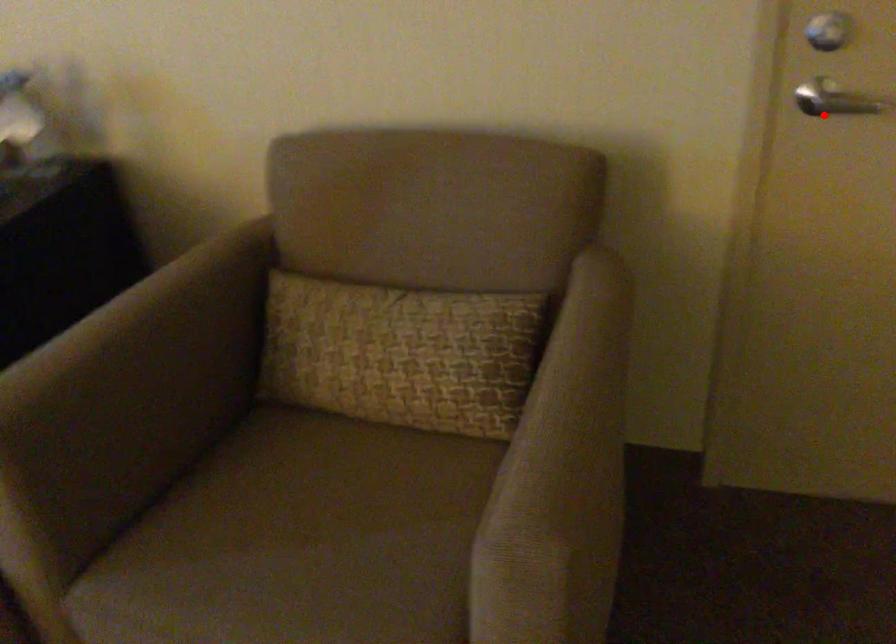
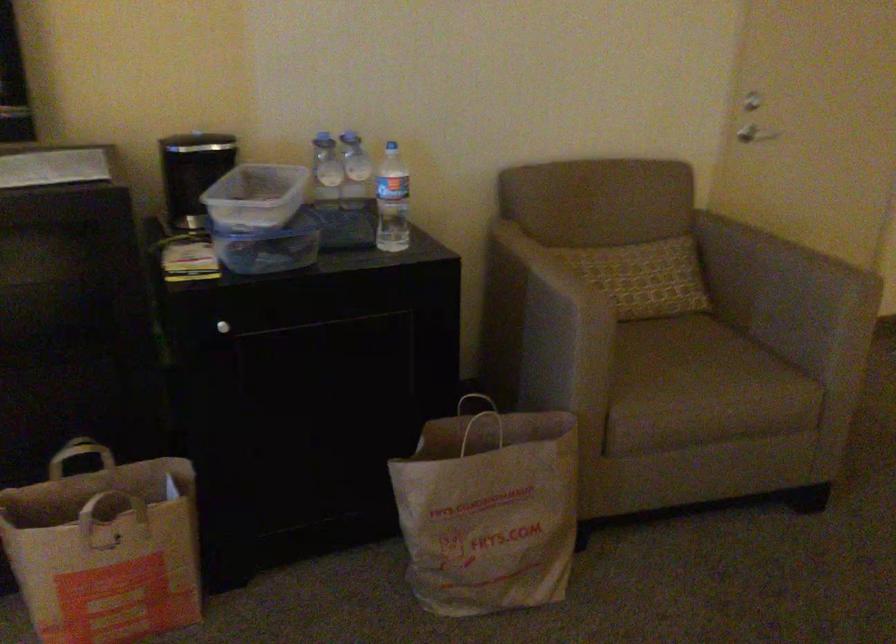
Locate, in the second image, the point that corresponds to the highlighted location in the first image.

(760, 135)